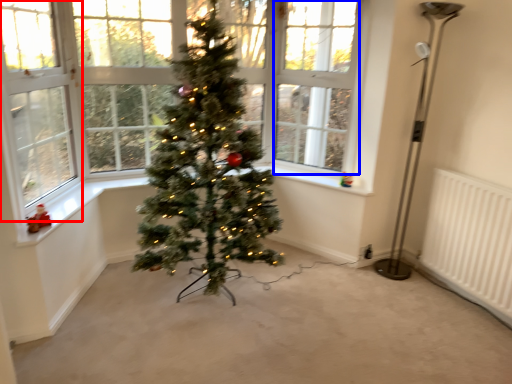
Question: Which object appears closest to the camera in this image, window screen (highlighted by a red box) or window screen (highlighted by a blue box)?

Choices:
 (A) window screen
 (B) window screen

Answer: (A)